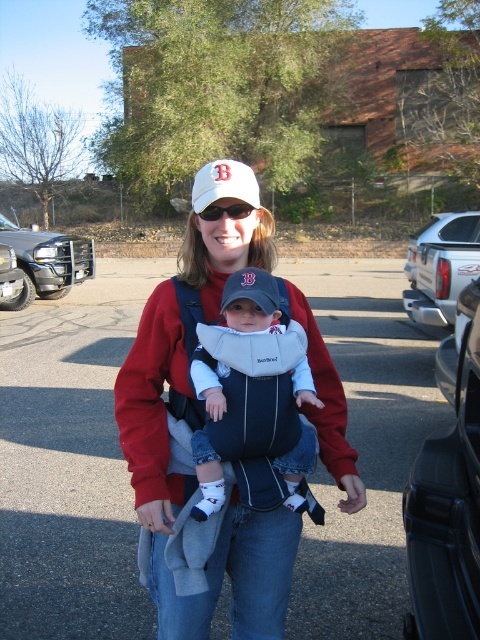
Between gray asphalt parking lot at center and white matte baseball cap at center, which one appears on the right side from the viewer's perspective?

gray asphalt parking lot at center is more to the right.

Describe the element at coordinates (71, 464) in the screenshot. I see `gray asphalt parking lot at center` at that location.

Between point (320, 481) and point (195, 184), which one is positioned in front?

Point (195, 184) is more forward.

You are a GUI agent. You are given a task and a screenshot of the screen. Output one action in this format:
    pyautogui.click(x=<x>, y=<y>)
    Task: Click on the gray asphalt parking lot at center
    The image size is (480, 640).
    Given the screenshot: What is the action you would take?
    (71, 464)

The height and width of the screenshot is (640, 480). I want to click on matte red sweatshirt at center, so click(184, 492).

Is point (345, 420) behind point (305, 428)?

Yes, point (345, 420) is farther from viewer.

Does point (184, 250) come in front of point (225, 401)?

No, (184, 250) is behind (225, 401).

Identify the location of matte red sweatshirt at center. (184, 492).

Does black plastic truck at right have a larger size compared to brushed metal truck at left?

No, black plastic truck at right is not bigger than brushed metal truck at left.

The height and width of the screenshot is (640, 480). Identify the location of black plastic truck at right. (447, 508).

Locate an element on the screen. This screenshot has width=480, height=640. black plastic truck at right is located at coordinates (447, 508).

I want to click on black plastic truck at right, so pyautogui.click(x=447, y=508).